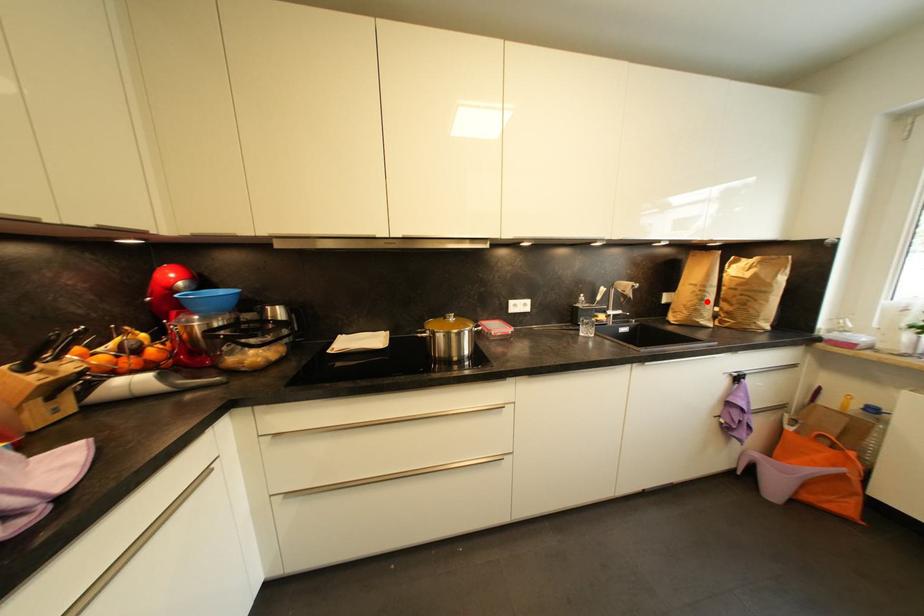
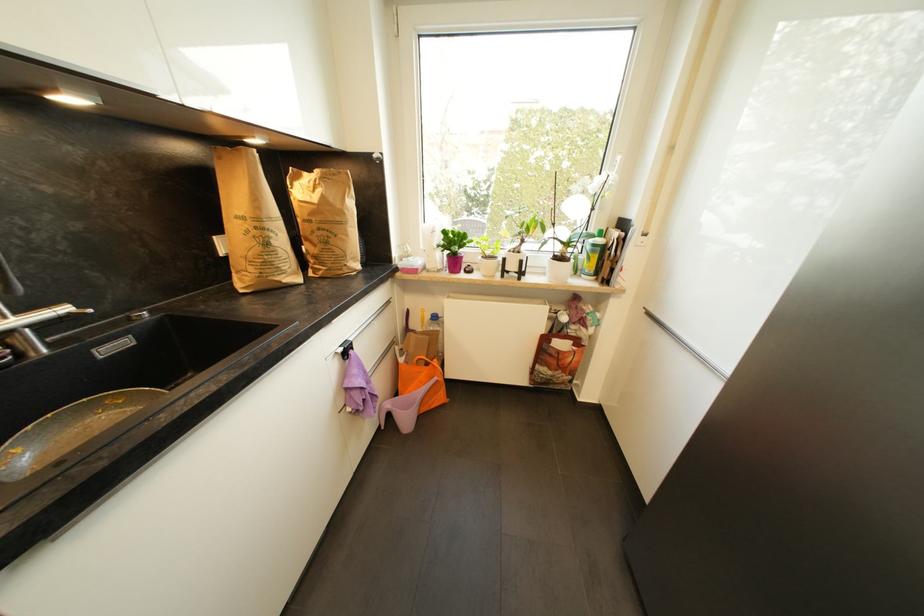
In the second image, find the point that corresponds to the highlighted location in the first image.

(272, 246)